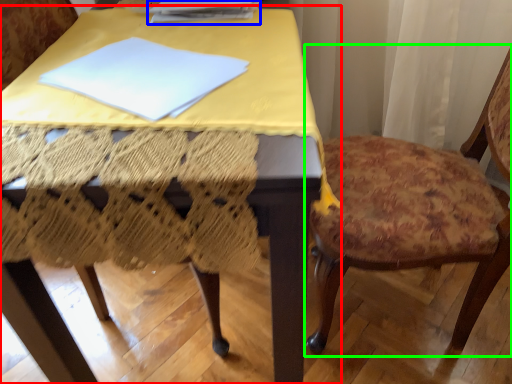
Question: Which object is positioned farthest from table (highlighted by a red box)? Select from paperback book (highlighted by a blue box) and chair (highlighted by a green box).

Choices:
 (A) paperback book
 (B) chair

Answer: (B)